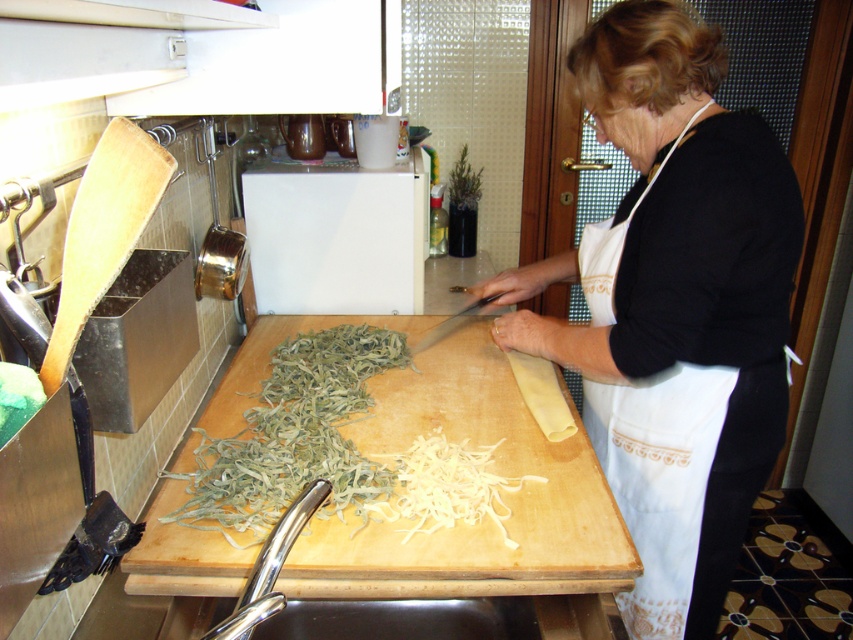
Measure the distance from white apron at center to white cotton apron at center.

They are 1.78 inches apart.

Is white apron at center to the right of white cotton apron at center from the viewer's perspective?

No, white apron at center is not to the right of white cotton apron at center.

Who is more distant from viewer, (753,275) or (607,435)?

The point (607,435) is behind.

The image size is (853, 640). Identify the location of white apron at center. (674, 307).

Can you confirm if white apron at center is positioned below wooden cutting board at center?

Actually, white apron at center is above wooden cutting board at center.

Who is more forward, (532, 348) or (454, 580)?

Point (454, 580) is more forward.

Between point (608, 64) and point (587, 442), which one is positioned behind?

Positioned behind is point (587, 442).

I want to click on white apron at center, so click(x=674, y=307).

Can you confirm if wooden cutting board at center is positioned below white noodle at center?

Incorrect, wooden cutting board at center is not positioned below white noodle at center.

Consider the image. Does wooden cutting board at center have a larger size compared to white noodle at center?

Correct, wooden cutting board at center is larger in size than white noodle at center.

Is point (480, 444) closer to camera compared to point (415, 481)?

No, (480, 444) is behind (415, 481).

The image size is (853, 640). I want to click on wooden cutting board at center, so click(486, 516).